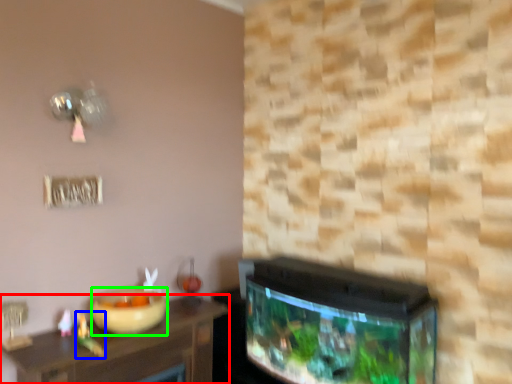
Question: Which object is the farthest from table (highlighted by a red box)? Choose among these: toy (highlighted by a blue box) or bowl (highlighted by a green box).

Choices:
 (A) toy
 (B) bowl

Answer: (A)